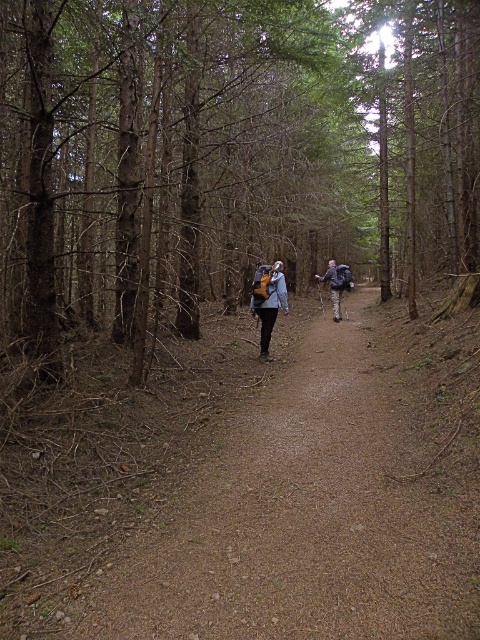
You are a hiker on the forest trail and you want to check if your matte gray jacket at center is positioned lower than your matte gray backpack at center. Based on the scene, can you confirm this?

Yes, the matte gray jacket at center is below the matte gray backpack at center, so it is positioned lower.

You are hiking on the dirt path at center and want to take a photo of the brown bark tree at center. Which side of the path should you stand on to get the tree in your shot?

You should stand on the left side of the dirt path at center because the brown bark tree at center is to the right of the path, so positioning yourself on the left will allow you to capture the tree in your photo.